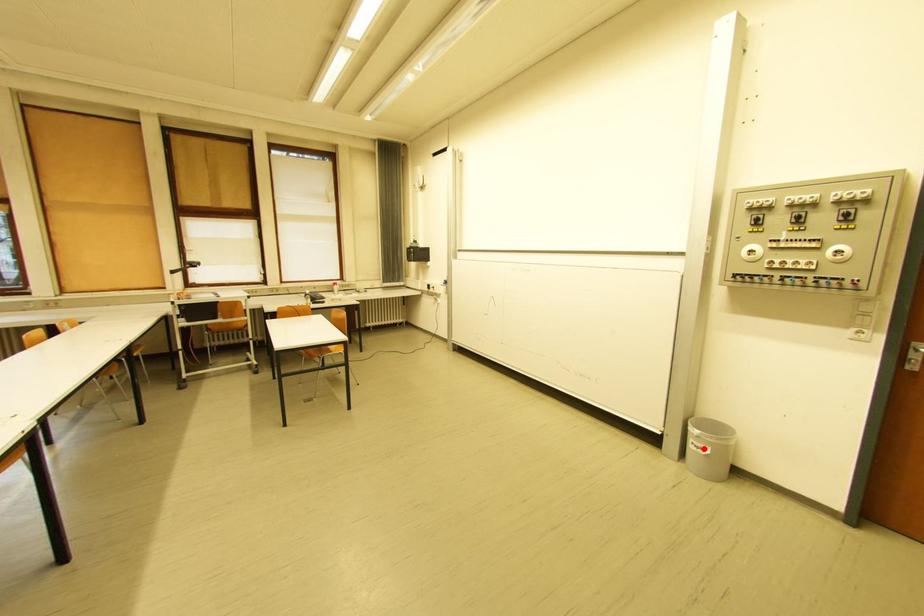
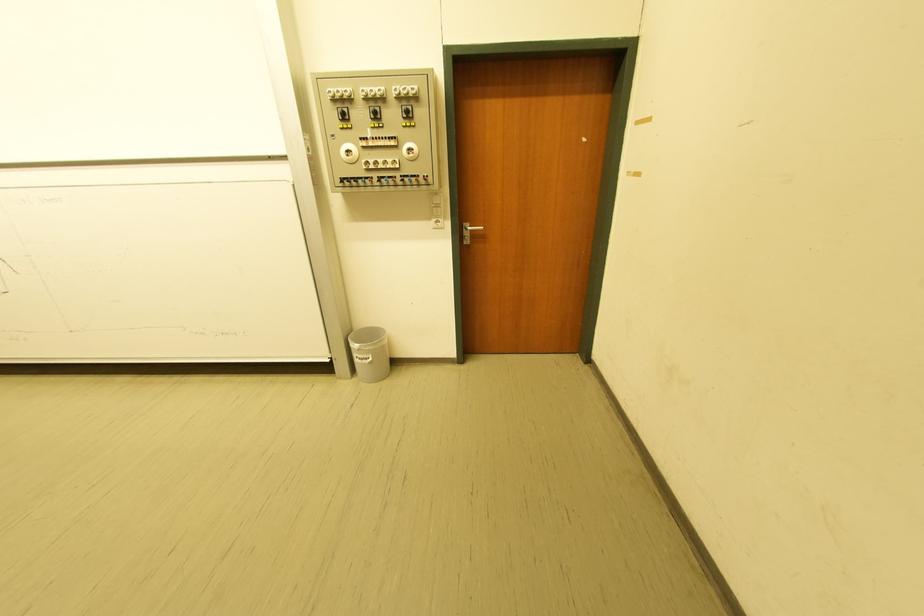
Locate, in the second image, the point that corresponds to the highlighted location in the first image.

(368, 361)